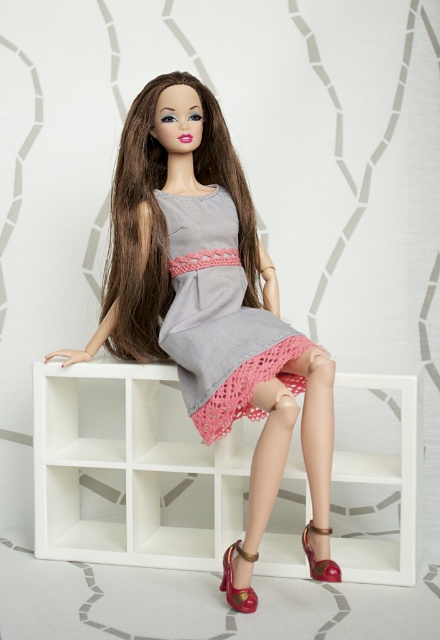
Can you confirm if matte gray dress at center is positioned to the left of white matte shelf at center?

Yes, matte gray dress at center is to the left of white matte shelf at center.

Which is more to the right, matte gray dress at center or white matte shelf at center?

Positioned to the right is white matte shelf at center.

Is point (242, 378) in front of point (206, 554)?

Yes, point (242, 378) is closer to viewer.

At what (x,y) coordinates should I click in order to perform the action: click on matte gray dress at center. Please return your answer as a coordinate pair (x, y). This screenshot has width=440, height=640. Looking at the image, I should click on (209, 292).

Does shiny gold sandal at lower center appear under shiny red leather sandal at lower right?

Yes.

Which is more to the right, shiny gold sandal at lower center or shiny red leather sandal at lower right?

shiny red leather sandal at lower right is more to the right.

Who is more forward, (230, 604) or (330, 572)?

Positioned in front is point (330, 572).

This screenshot has width=440, height=640. In order to click on shiny gold sandal at lower center in this screenshot , I will do pos(233,582).

Can you confirm if white matte shelf at center is taller than shiny red leather sandal at lower right?

Indeed, white matte shelf at center has a greater height compared to shiny red leather sandal at lower right.

Measure the distance between white matte shelf at center and camera.

white matte shelf at center is 1.96 meters from camera.

Is point (231, 470) positioned after point (314, 566)?

Yes.

The image size is (440, 640). Identify the location of white matte shelf at center. (127, 474).